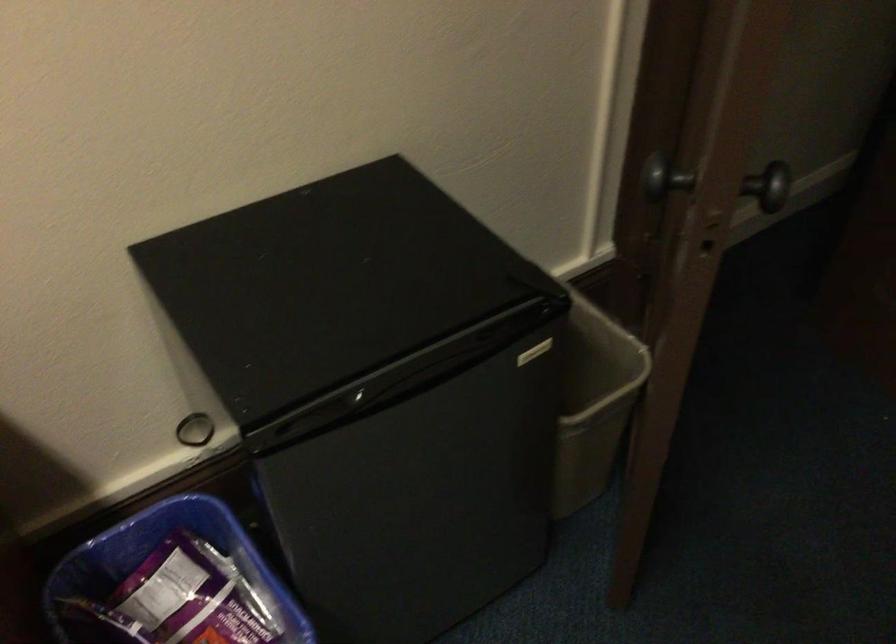
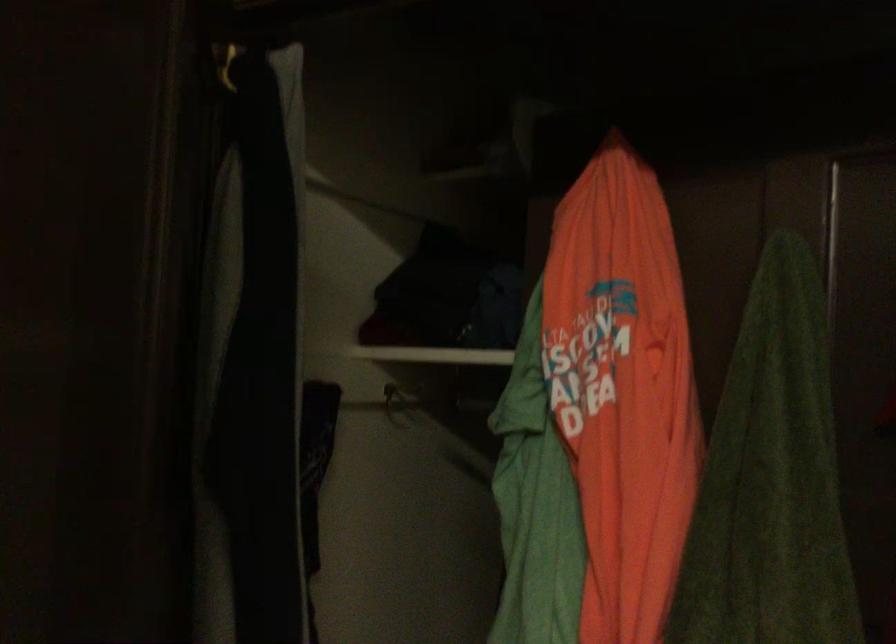
The images are taken continuously from a first-person perspective. In which direction is your viewpoint rotating?

The camera's rotation is toward right-up.